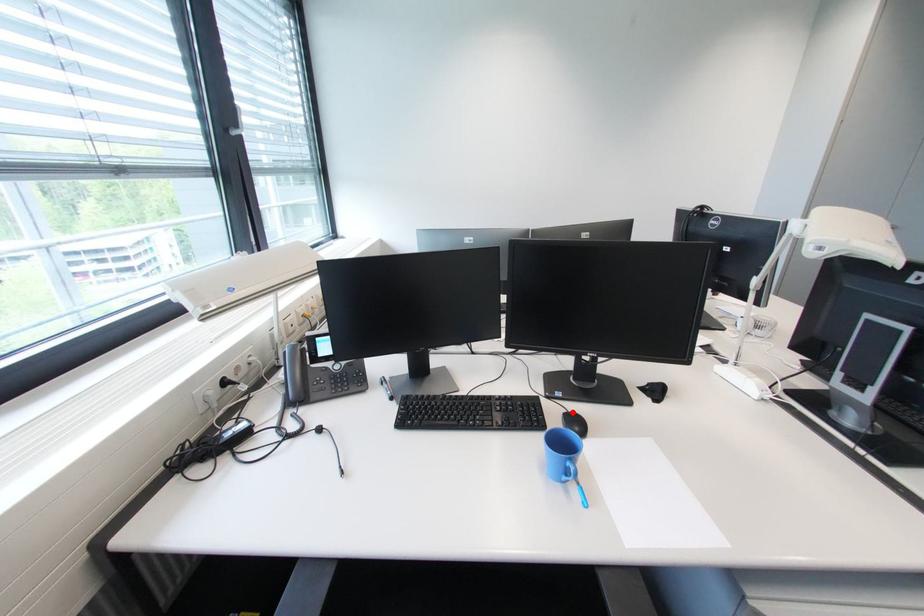
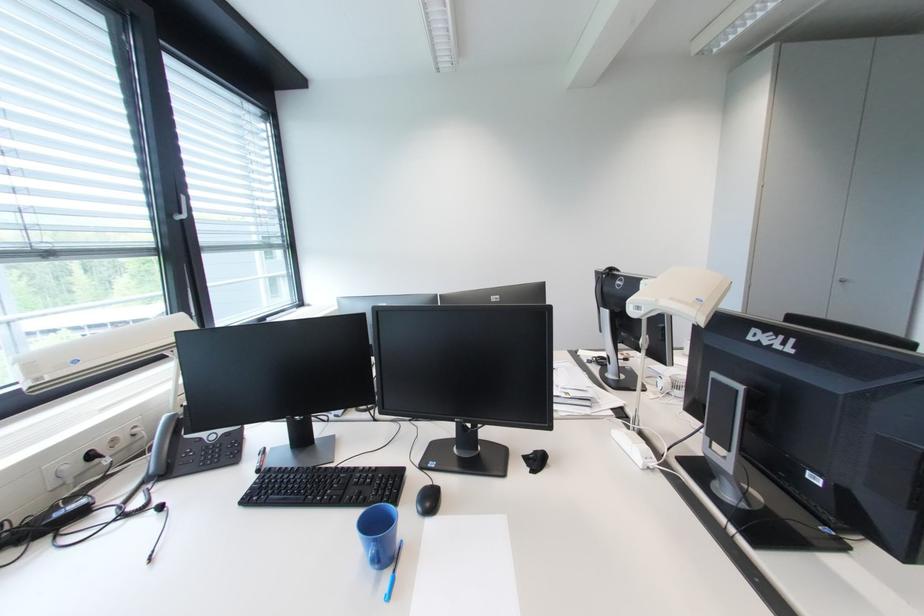
Locate, in the second image, the point that corresponds to the highlighted location in the first image.

(438, 485)